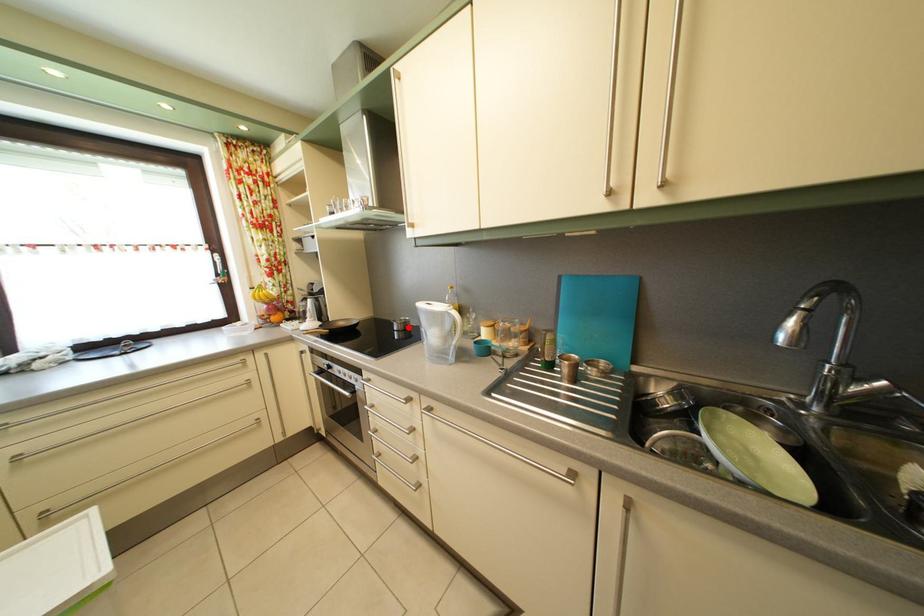
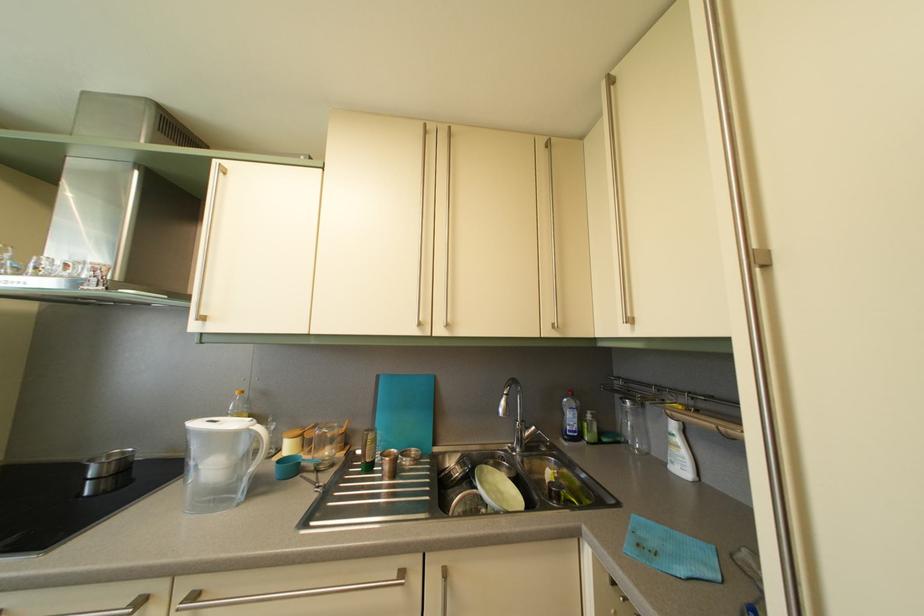
In the second image, find the point that corresponds to the highlighted location in the first image.

(118, 463)